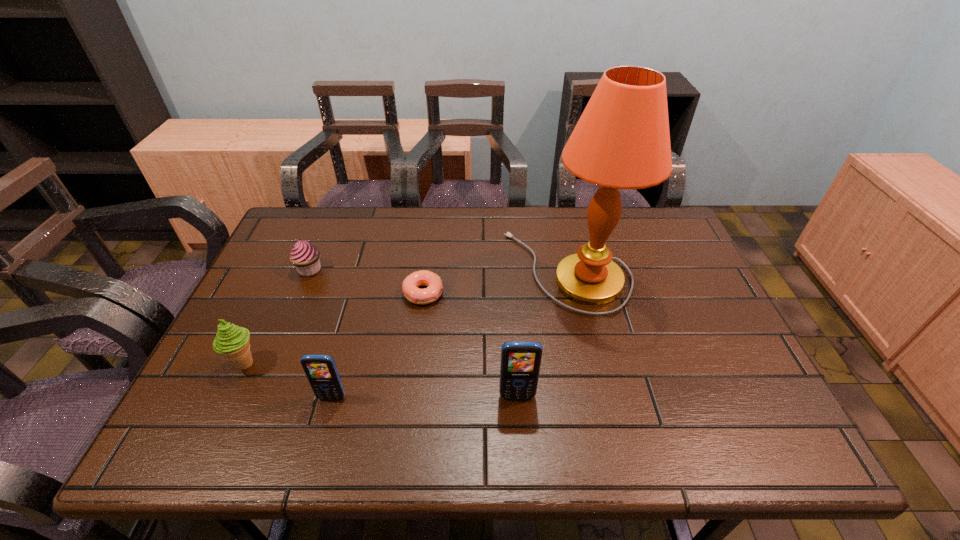
Find the location of a particular element. free space between the third object from right to left and the second tallest object is located at coordinates (470, 345).

Locate an element on the screen. object that stands as the second closest to the doughnut is located at coordinates (305, 256).

Where is `the third closest object to the right cellular telephone`? the third closest object to the right cellular telephone is located at coordinates (321, 371).

Where is `free spot that satisfies the following two spatial constraints: 1. on the back side of the doughnut; 2. on the right side of the lamp`? The image size is (960, 540). free spot that satisfies the following two spatial constraints: 1. on the back side of the doughnut; 2. on the right side of the lamp is located at coordinates [x=426, y=271].